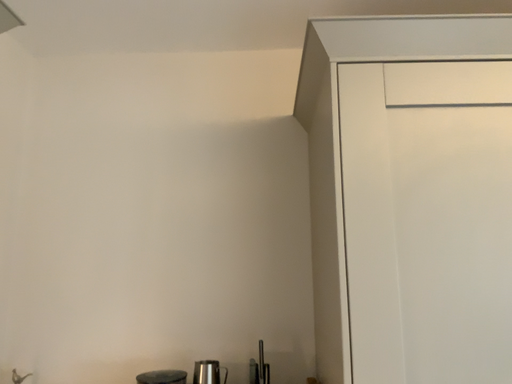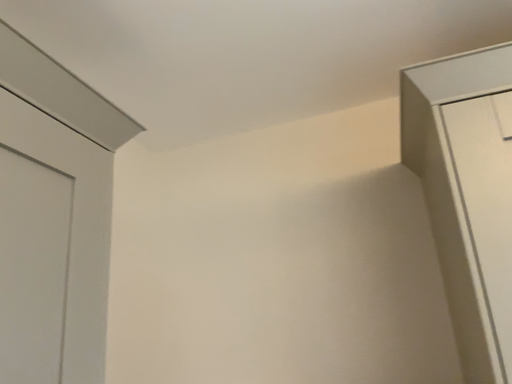
Question: How did the camera likely rotate when shooting the video?

Choices:
 (A) rotated upward
 (B) rotated downward

Answer: (A)